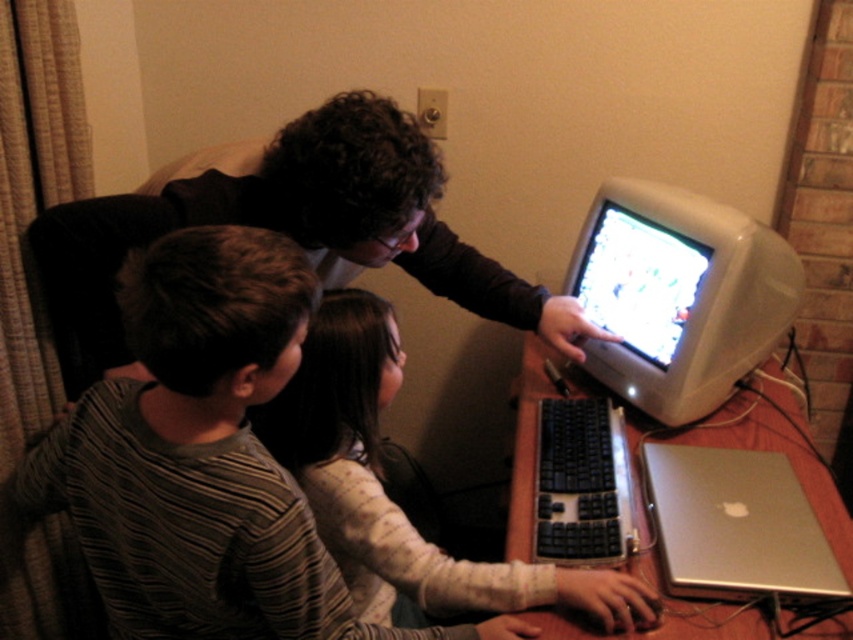
Which is below, matte black shirt at upper center or silver metallic laptop at lower right?

silver metallic laptop at lower right is below.

Is matte black shirt at upper center shorter than silver metallic laptop at lower right?

Incorrect, matte black shirt at upper center's height does not fall short of silver metallic laptop at lower right's.

Does point (425, 260) come farther from viewer compared to point (724, 524)?

Yes, it is behind point (724, 524).

The width and height of the screenshot is (853, 640). In order to click on matte black shirt at upper center in this screenshot , I will do `click(291, 230)`.

Can you confirm if matte black shirt at upper center is positioned to the right of wooden desk at center?

No, matte black shirt at upper center is not to the right of wooden desk at center.

Does matte black shirt at upper center come behind wooden desk at center?

That is True.

Is point (192, 200) behind point (837, 508)?

No, it is in front of (837, 508).

Image resolution: width=853 pixels, height=640 pixels. Identify the location of matte black shirt at upper center. (291, 230).

Is silver metallic laptop at lower right in front of wooden desk at center?

No, it is not.

How far apart are silver metallic laptop at lower right and wooden desk at center?

3.19 inches

Describe the element at coordinates (735, 525) in the screenshot. I see `silver metallic laptop at lower right` at that location.

At what (x,y) coordinates should I click in order to perform the action: click on silver metallic laptop at lower right. Please return your answer as a coordinate pair (x, y). The height and width of the screenshot is (640, 853). Looking at the image, I should click on (735, 525).